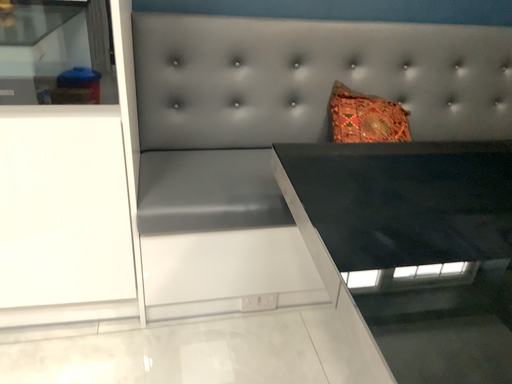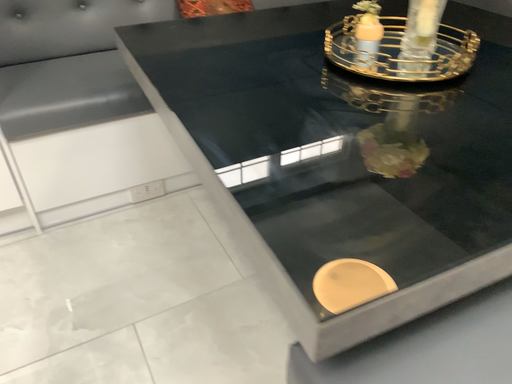
Question: How did the camera likely rotate when shooting the video?

Choices:
 (A) rotated right
 (B) rotated left

Answer: (A)